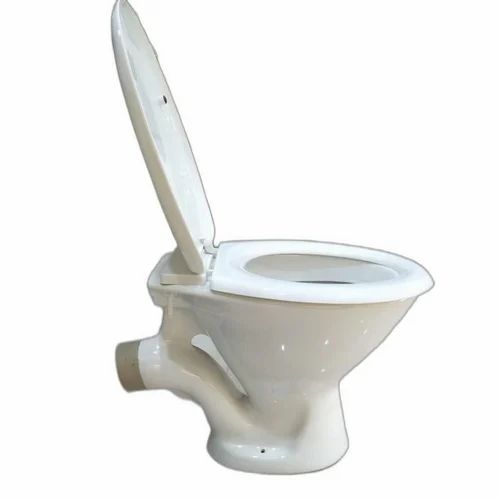
You are a GUI agent. You are given a task and a screenshot of the screen. Output one action in this format:
    pyautogui.click(x=<x>, y=<y>)
    Task: Click on the toilet seat
    This screenshot has width=500, height=500.
    Given the screenshot: What is the action you would take?
    pyautogui.click(x=237, y=278)